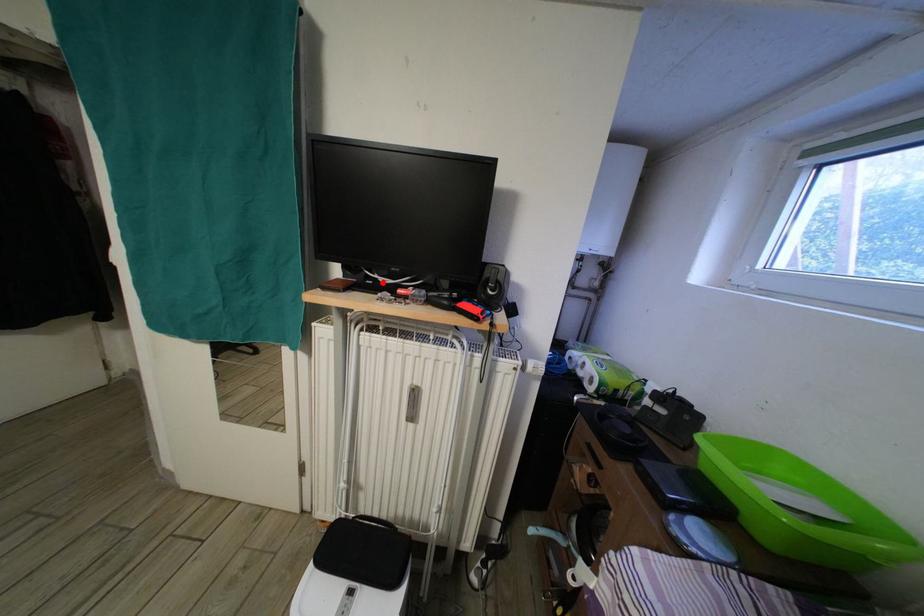
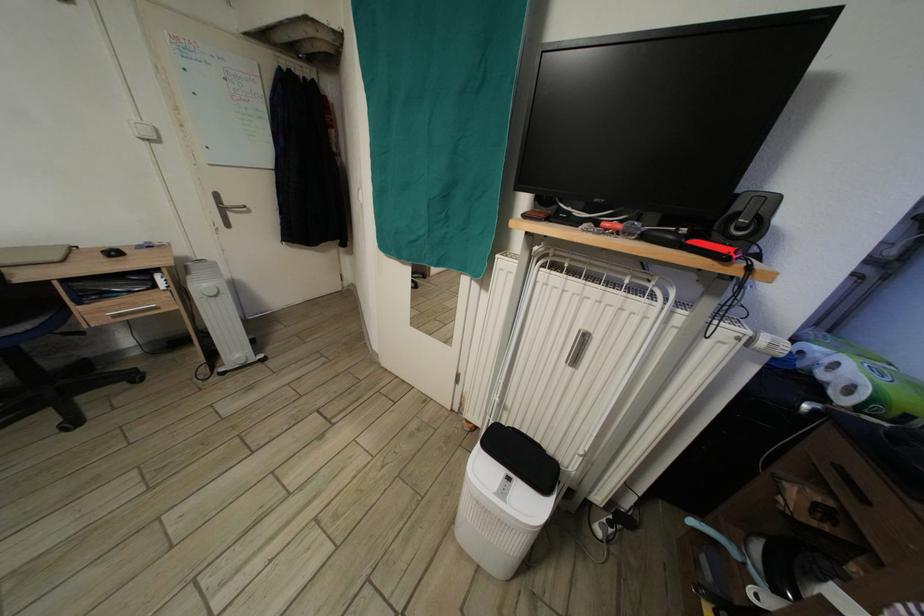
Where in the second image is the point corresponding to the highlighted location from the first image?

(576, 216)